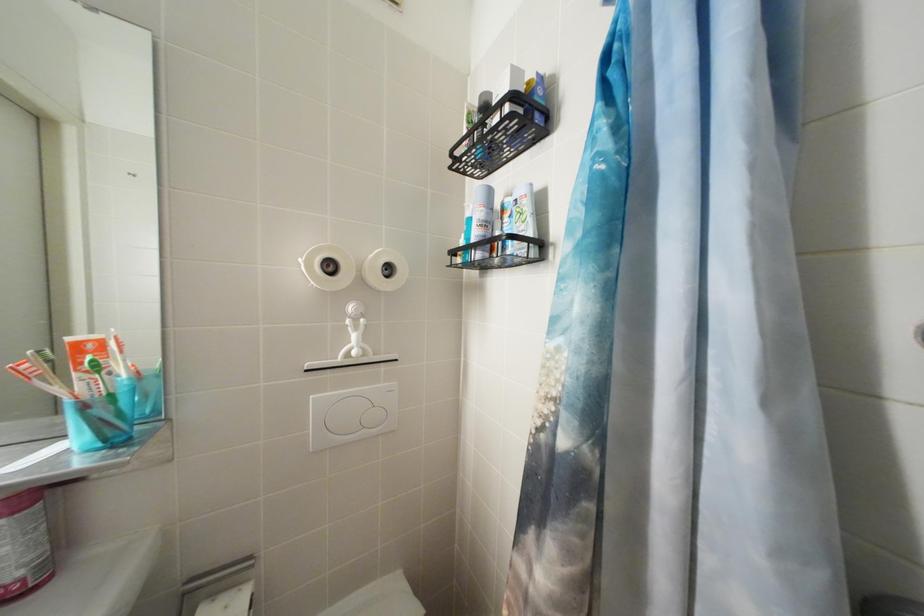
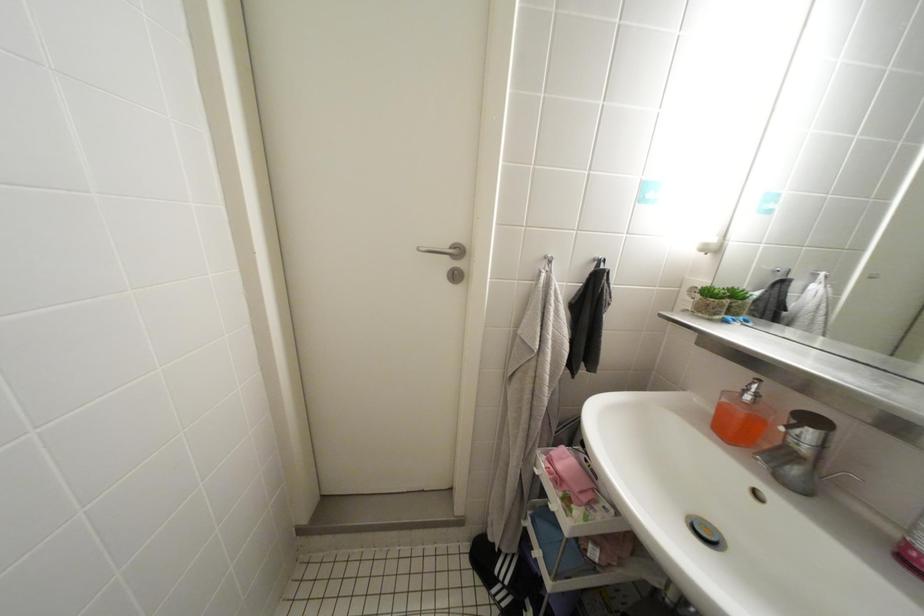
Based on the continuous images, in which direction is the camera rotating?

The camera's rotation is toward left-down.